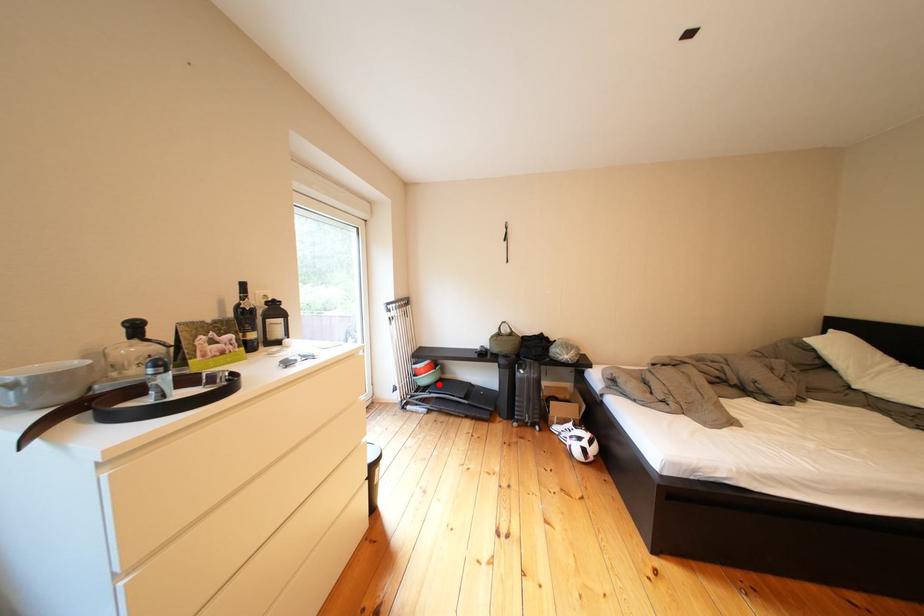
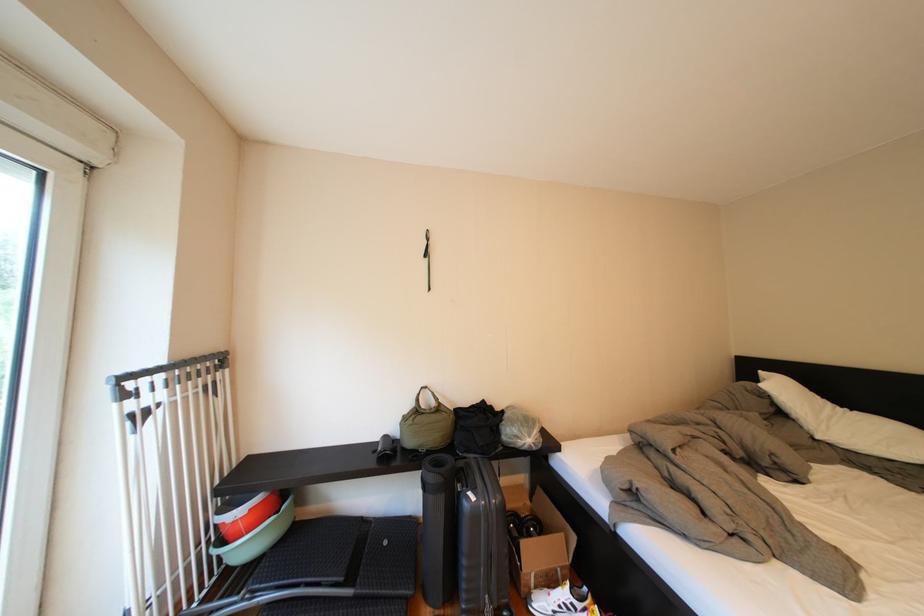
Find the pixel in the second image that matches the highlighted location in the first image.

(261, 551)